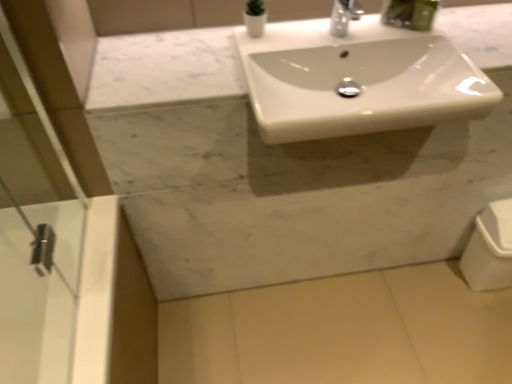
What do you see at coordinates (255, 18) in the screenshot? The height and width of the screenshot is (384, 512). I see `white glossy vase at upper center` at bounding box center [255, 18].

Find the location of `white glossy vase at upper center`. white glossy vase at upper center is located at coordinates (255, 18).

Would you say white glossy vase at upper center is part of white glossy sink at center's contents?

That's incorrect, white glossy vase at upper center is not inside white glossy sink at center.

Locate an element on the screen. This screenshot has width=512, height=384. toiletry to the left of white glossy sink at center is located at coordinates (255, 18).

From a real-world perspective, which is physically above, white glossy sink at center or white glossy vase at upper center?

In real-world perspective, white glossy vase at upper center is above.

Considering the sizes of white glossy vase at upper center and white glossy trash can at lower right in the image, is white glossy vase at upper center wider or thinner than white glossy trash can at lower right?

white glossy vase at upper center is thinner than white glossy trash can at lower right.

From a real-world perspective, is white glossy vase at upper center on white glossy trash can at lower right?

Yes, from a real-world perspective, white glossy vase at upper center is on top of white glossy trash can at lower right.

Where is `porcelain below the white glossy vase at upper center (from a real-world perspective)`? Image resolution: width=512 pixels, height=384 pixels. porcelain below the white glossy vase at upper center (from a real-world perspective) is located at coordinates (490, 249).

Does white glossy vase at upper center appear on the right side of white glossy trash can at lower right?

No, white glossy vase at upper center is not to the right of white glossy trash can at lower right.

How much distance is there between white glossy trash can at lower right and white glossy vase at upper center?

1.04 meters.

Between white glossy trash can at lower right and white glossy vase at upper center, which one has less height?

With less height is white glossy vase at upper center.

From a real-world perspective, which is physically below, white glossy trash can at lower right or white glossy vase at upper center?

white glossy trash can at lower right.

From the image's perspective, is white glossy trash can at lower right positioned above or below white glossy vase at upper center?

white glossy trash can at lower right is below white glossy vase at upper center.

From a real-world perspective, is white glossy sink at center located higher than white glossy trash can at lower right?

Yes, from a real-world perspective, white glossy sink at center is on top of white glossy trash can at lower right.

Considering the relative sizes of white glossy sink at center and white glossy trash can at lower right in the image provided, is white glossy sink at center smaller than white glossy trash can at lower right?

No, white glossy sink at center is not smaller than white glossy trash can at lower right.

Is white glossy sink at center taller than white glossy trash can at lower right?

Incorrect, the height of white glossy sink at center is not larger of that of white glossy trash can at lower right.

Is white glossy sink at center facing towards white glossy trash can at lower right?

No, white glossy sink at center is not oriented towards white glossy trash can at lower right.

From a real-world perspective, which is physically above, white glossy vase at upper center or white glossy sink at center?

white glossy vase at upper center.

Does white glossy vase at upper center turn towards white glossy sink at center?

No, white glossy vase at upper center is not turned towards white glossy sink at center.

Is white glossy vase at upper center completely or partially outside of white glossy sink at center?

Indeed, white glossy vase at upper center is completely outside white glossy sink at center.

How different are the orientations of white glossy vase at upper center and white glossy sink at center in degrees?

The angular difference between white glossy vase at upper center and white glossy sink at center is 0.0027 degrees.

Considering the sizes of objects white glossy trash can at lower right and white glossy sink at center in the image provided, who is smaller, white glossy trash can at lower right or white glossy sink at center?

white glossy trash can at lower right is smaller.

Is white glossy sink at center a part of white glossy trash can at lower right?

That's incorrect, white glossy sink at center is not inside white glossy trash can at lower right.

Is point (502, 242) closer or farther from the camera than point (275, 126)?

Point (502, 242) appears to be farther away from the viewer than point (275, 126).

Measure the distance between white glossy trash can at lower right and white glossy sink at center.

A distance of 27.10 inches exists between white glossy trash can at lower right and white glossy sink at center.

Locate an element on the screen. The height and width of the screenshot is (384, 512). toiletry above the white glossy sink at center (from the image's perspective) is located at coordinates (255, 18).

I want to click on toiletry in front of the white glossy trash can at lower right, so click(255, 18).

Looking at the image, which one is located further to white glossy trash can at lower right, white glossy vase at upper center or white glossy sink at center?

white glossy vase at upper center is further to white glossy trash can at lower right.

Based on their spatial positions, is white glossy vase at upper center or white glossy trash can at lower right closer to white glossy sink at center?

white glossy vase at upper center is positioned closer to the anchor white glossy sink at center.

Based on their spatial positions, is white glossy trash can at lower right or white glossy sink at center further from white glossy vase at upper center?

The object further to white glossy vase at upper center is white glossy trash can at lower right.

Which object lies further to the anchor point white glossy trash can at lower right, white glossy sink at center or white glossy vase at upper center?

The object further to white glossy trash can at lower right is white glossy vase at upper center.

Which object lies nearer to the anchor point white glossy vase at upper center, white glossy sink at center or white glossy trash can at lower right?

white glossy sink at center lies closer to white glossy vase at upper center than the other object.

Which object lies further to the anchor point white glossy sink at center, white glossy trash can at lower right or white glossy vase at upper center?

white glossy trash can at lower right.

Find the location of a particular element. Image resolution: width=512 pixels, height=384 pixels. sink located between white glossy vase at upper center and white glossy trash can at lower right in the left-right direction is located at coordinates (357, 80).